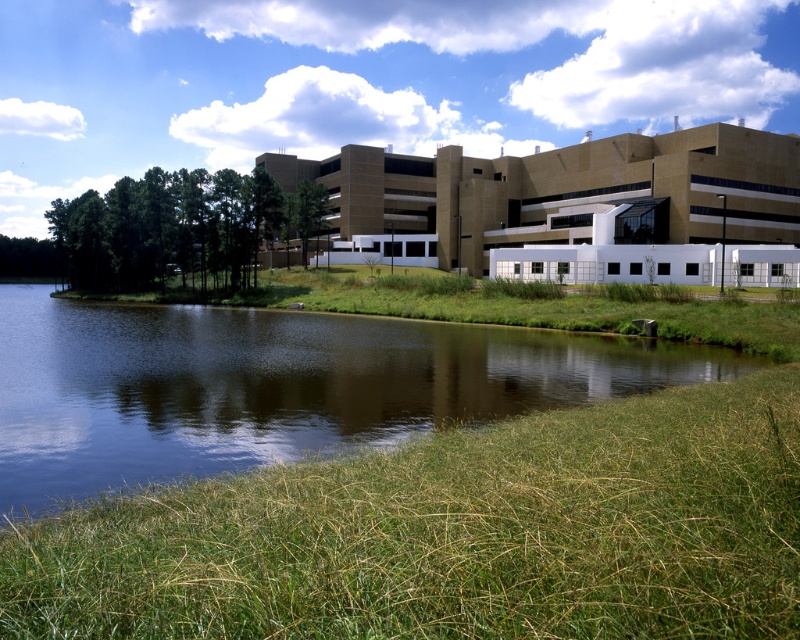
You are standing at the origin point of the image coordinate system. You want to walk to the green grass at lower center. What are the coordinates you need to move to?

The coordinates to reach the green grass at lower center are at point [454,534].